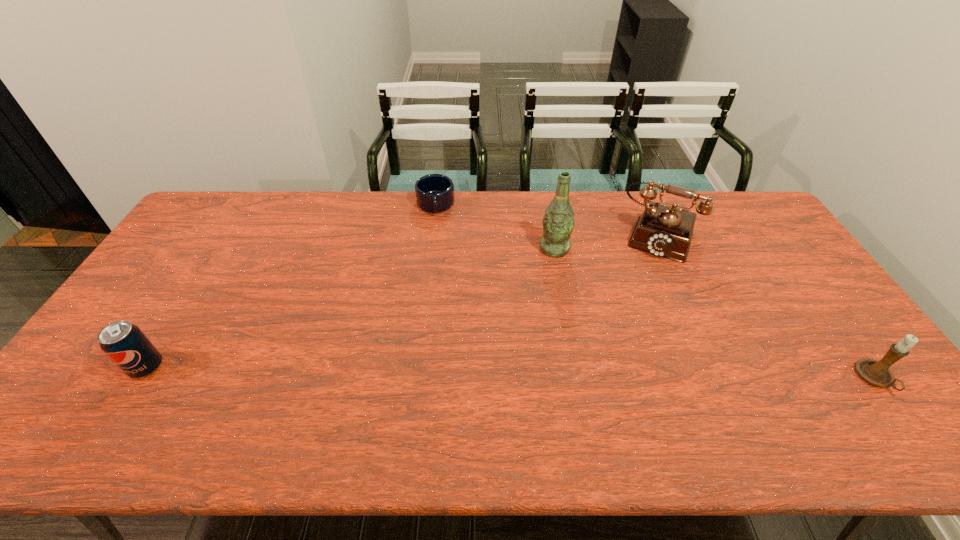
What are the coordinates of `free space located 0.380m on the dial of the second object from right to left` in the screenshot? It's located at (621, 347).

Identify the location of vacant area situated on the dial of the second object from right to left. The height and width of the screenshot is (540, 960). (622, 345).

The width and height of the screenshot is (960, 540). Find the location of `vacant area located on the surface of the beer bottle`. vacant area located on the surface of the beer bottle is located at coordinates (528, 348).

Identify the location of free space located 0.060m on the surface of the beer bottle. Image resolution: width=960 pixels, height=540 pixels. (548, 271).

Find the location of a particular element. The height and width of the screenshot is (540, 960). vacant region located 0.310m on the surface of the beer bottle is located at coordinates (532, 333).

What are the coordinates of `free space located 0.400m with the handle on the side of the fourth object from right to left` in the screenshot? It's located at (440, 305).

Where is `vacant region located with the handle on the side of the fourth object from right to left`? vacant region located with the handle on the side of the fourth object from right to left is located at coordinates (438, 264).

Find the location of a particular element. The height and width of the screenshot is (540, 960). free space located 0.250m with the handle on the side of the fourth object from right to left is located at coordinates (438, 268).

Find the location of a particular element. The width and height of the screenshot is (960, 540). telephone that is at the far edge is located at coordinates (664, 231).

At what (x,y) coordinates should I click in order to perform the action: click on mug that is at the far edge. Please return your answer as a coordinate pair (x, y). The height and width of the screenshot is (540, 960). Looking at the image, I should click on (434, 193).